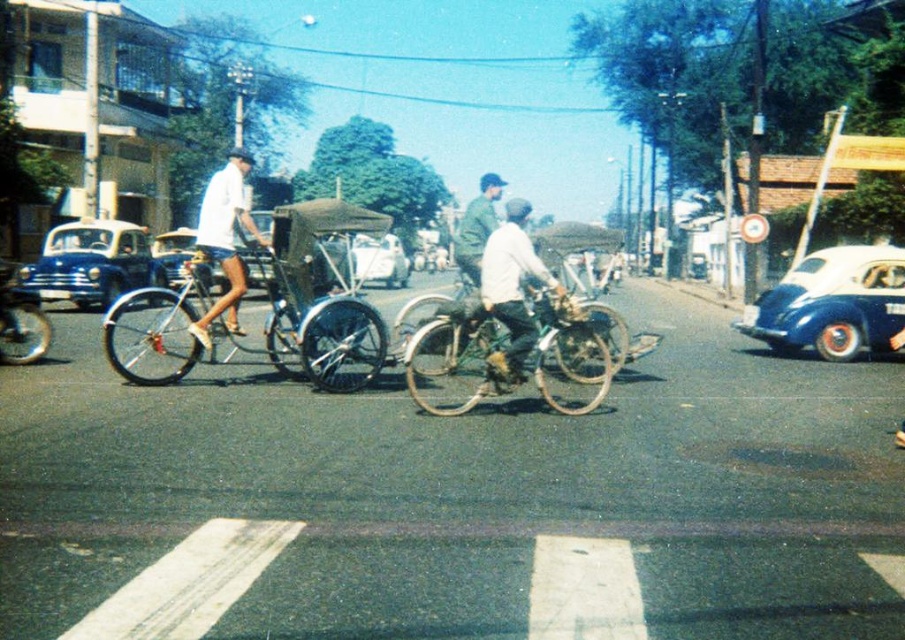
You are a delivery person needing to park your 2.5 meters long delivery van between the blue matte car at right and the blue matte car at left. Can you fit your van between them without overlapping either car?

The distance between the blue matte car at right and the blue matte car at left is 14.80 meters. Since your delivery van is only 2.5 meters long, there is more than enough space to park it between them without overlapping either car.

Looking at this image, you are a delivery person needing to park your vehicle in a tight space. You have a blue matte car at left and a white glossy car at center. Which car would require more space to park?

The blue matte car at left requires more space to park because it is larger in size than the white glossy car at center.

You are a pedestrian standing on the sidewalk and see the gold metallic bicycle at center and the white glossy car at center. Which one is closer to the right side of the sidewalk?

The gold metallic bicycle at center is to the right of the white glossy car at center, so it is closer to the right side of the sidewalk.